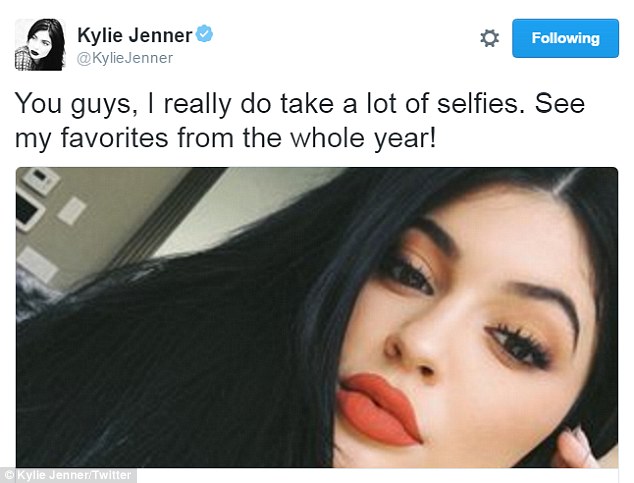
This screenshot has width=634, height=483. What are the coordinates of `walll` in the screenshot? It's located at (115, 192).